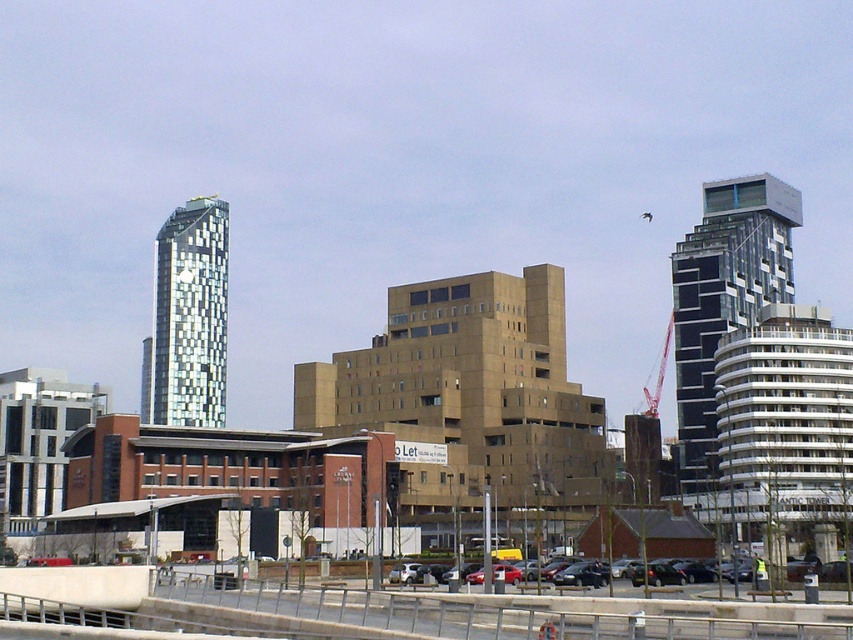
Does point (840, 568) come farther from viewer compared to point (654, 580)?

That is False.

Which is below, matte red car at center or shiny black sedan at center?

matte red car at center is lower down.

This screenshot has height=640, width=853. What are the coordinates of `matte red car at center` in the screenshot? It's located at [x=819, y=570].

The height and width of the screenshot is (640, 853). Find the location of `matte red car at center`. matte red car at center is located at coordinates (819, 570).

Who is taller, matte red car at center or metallic silver car at center?

matte red car at center is taller.

Can you confirm if matte red car at center is taller than metallic silver car at center?

Indeed, matte red car at center has a greater height compared to metallic silver car at center.

Identify the location of matte red car at center. (819, 570).

Between glassy black skyscraper at right and metallic red crane at center right, which one is positioned lower?

Positioned lower is metallic red crane at center right.

Between glassy black skyscraper at right and metallic red crane at center right, which one appears on the right side from the viewer's perspective?

From the viewer's perspective, metallic red crane at center right appears more on the right side.

Measure the distance between point (706, 417) and camera.

The distance of point (706, 417) from camera is 177.79 meters.

Locate an element on the screen. This screenshot has height=640, width=853. glassy black skyscraper at right is located at coordinates (724, 300).